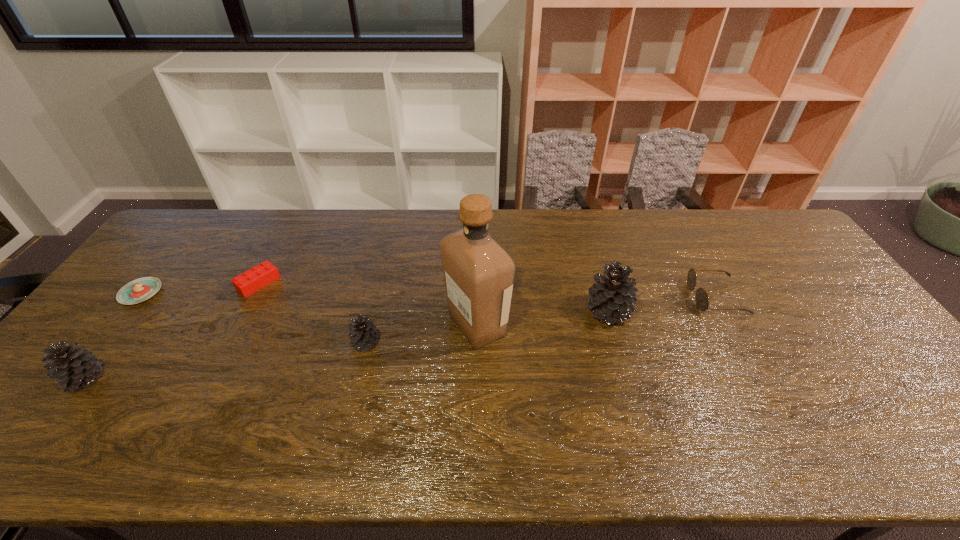
Select which object is the fifth closest to the pastry. Please provide its 2D coordinates. Your answer should be formatted as a tuple, i.e. [(x, y)], where the tuple contains the x and y coordinates of a point satisfying the conditions above.

[(612, 298)]

Identify which pinecone is the third closest to the third object from right to left. Please provide its 2D coordinates. Your answer should be formatted as a tuple, i.e. [(x, y)], where the tuple contains the x and y coordinates of a point satisfying the conditions above.

[(74, 367)]

I want to click on pinecone that is the second closest to the pastry, so click(363, 334).

You are a GUI agent. You are given a task and a screenshot of the screen. Output one action in this format:
    pyautogui.click(x=<x>, y=<y>)
    Task: Click on the free location that satisfies the following two spatial constraints: 1. on the back side of the fourth shortest object; 2. on the left side of the sixth object from left to right
    Image resolution: width=960 pixels, height=540 pixels.
    Given the screenshot: What is the action you would take?
    pyautogui.click(x=372, y=312)

I want to click on free space that satisfies the following two spatial constraints: 1. on the back side of the farthest pinecone; 2. on the right side of the fourth object from right to left, so click(x=372, y=312).

Find the location of `vacant space that satisfies the following two spatial constraints: 1. on the lenses of the sunglasses; 2. on the front side of the nearest object`. vacant space that satisfies the following two spatial constraints: 1. on the lenses of the sunglasses; 2. on the front side of the nearest object is located at coordinates (759, 378).